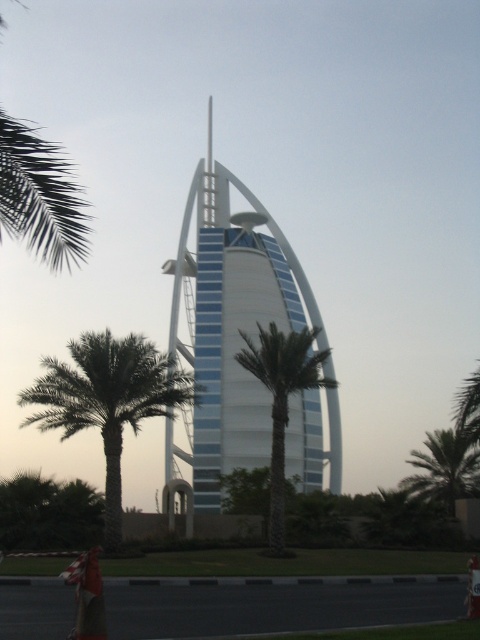
You are an architect analyzing the Burj Al Arab hotel. You notice the white smooth tower at center and the smooth glass spire at center. Which of these two structures is closer to the observer?

The white smooth tower at center is closer to the observer because it is in front of the smooth glass spire at center.

You are standing in front of the Burj Al Arab hotel and want to take a photo that includes both the white smooth tower at center and the green leafy palm tree at center. Which object should you position closer to the front of your camera frame to ensure both are in focus?

You should position the green leafy palm tree at center closer to the front of your camera frame because the white smooth tower at center is further away from you than the green leafy palm tree at center. This way, both will be in focus as the palm tree is nearer and the tower is farther back.

You are standing at the base of the Burj Al Arab hotel and want to take a photo of the two points mentioned. Which point is closer to you, point (x=201, y=438) or point (x=205, y=192)?

Point (x=201, y=438) is closer to the viewer than point (x=205, y=192).